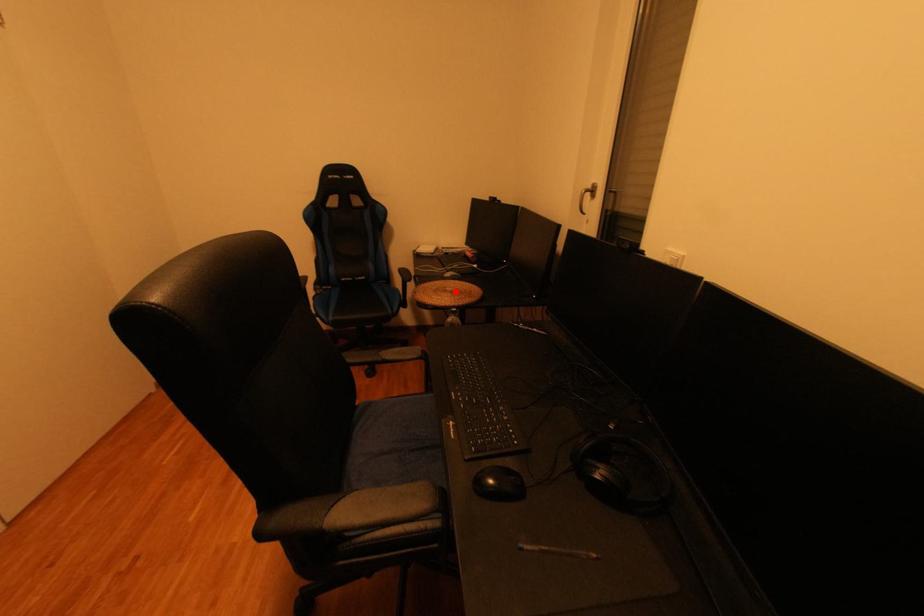
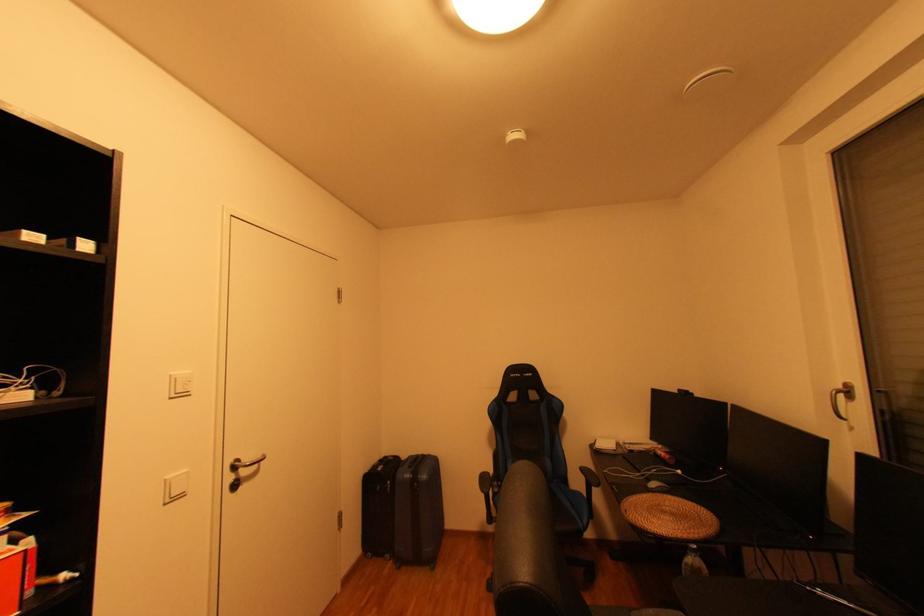
Where in the second image is the point corresponding to the highlighted location from the first image?

(674, 513)